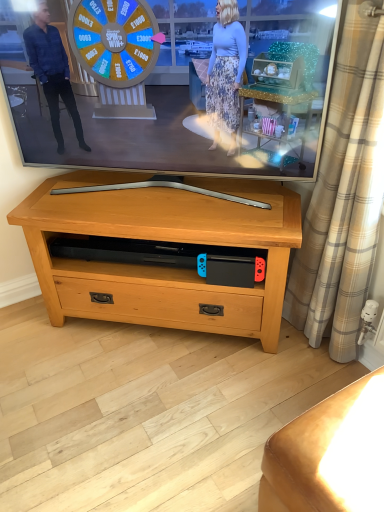
Question: Looking at their shapes, would you say beige plaid curtain at right is wider or thinner than leather couch at lower right?

Choices:
 (A) thin
 (B) wide

Answer: (A)

Question: From a real-world perspective, relative to leather couch at lower right, is beige plaid curtain at right vertically above or below?

Choices:
 (A) above
 (B) below

Answer: (A)

Question: Estimate the real-world distances between objects in this image. Which object is closer to the beige plaid curtain at right?

Choices:
 (A) pine wood tv stand at center
 (B) matte black tv at center
 (C) leather couch at lower right

Answer: (A)

Question: Estimate the real-world distances between objects in this image. Which object is farther from the leather couch at lower right?

Choices:
 (A) matte black tv at center
 (B) pine wood tv stand at center
 (C) beige plaid curtain at right

Answer: (A)